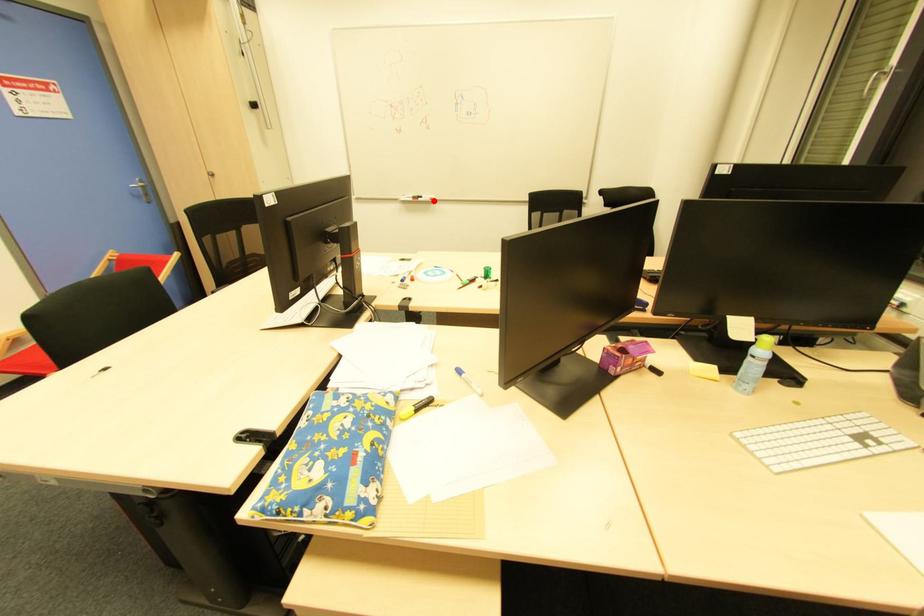
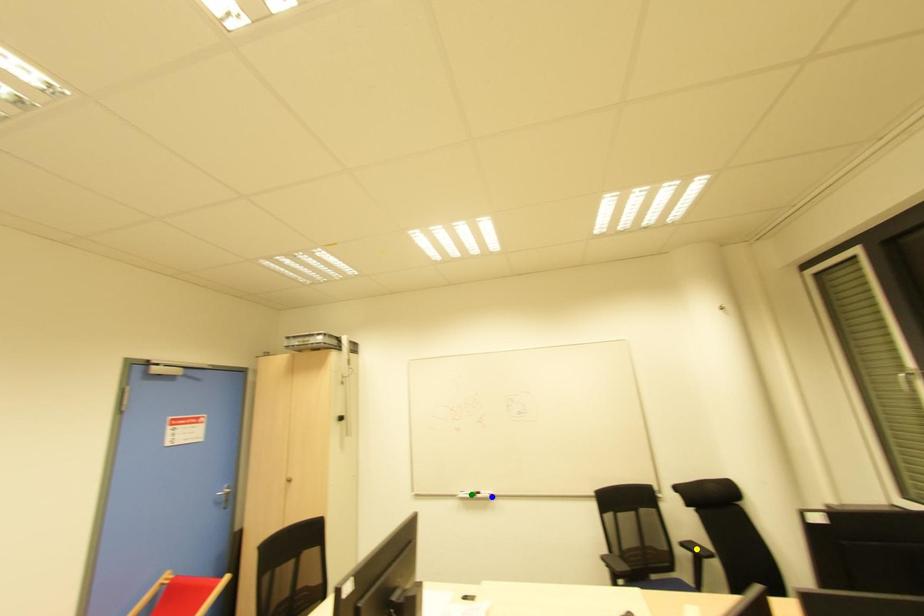
Question: I am providing you with two images of the same scene from different viewpoints. A red point is marked on the first image. You are given multiple points on the second image. Can you choose the point in image 2 that corresponds to the point in image 1?

Choices:
 (A) green point
 (B) yellow point
 (C) blue point

Answer: (C)